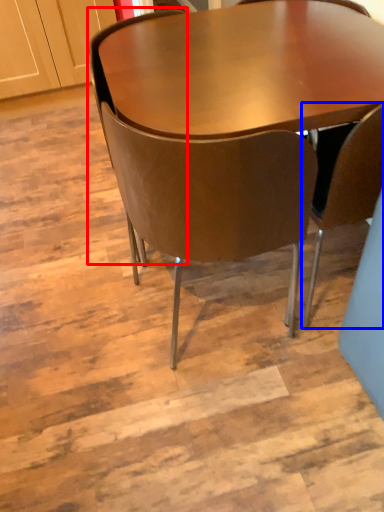
Question: Which object is closer to the camera taking this photo, chair (highlighted by a red box) or chair (highlighted by a blue box)?

Choices:
 (A) chair
 (B) chair

Answer: (B)